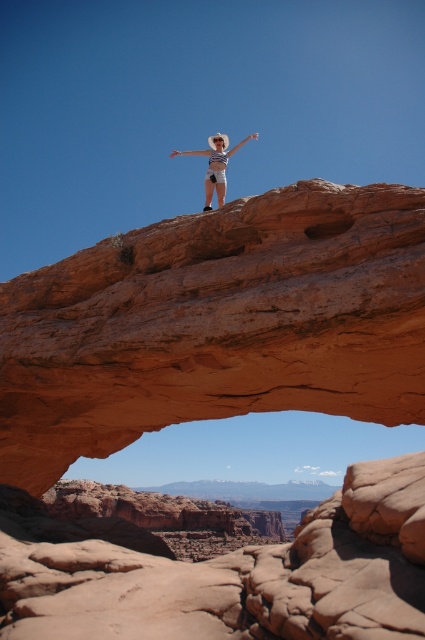
Is rustic sandstone arch at center to the right of matte white hat at center from the viewer's perspective?

In fact, rustic sandstone arch at center is to the left of matte white hat at center.

Measure the distance between rustic sandstone arch at center and camera.

rustic sandstone arch at center is 22.85 meters away from camera.

The height and width of the screenshot is (640, 425). Find the location of `rustic sandstone arch at center`. rustic sandstone arch at center is located at coordinates (218, 413).